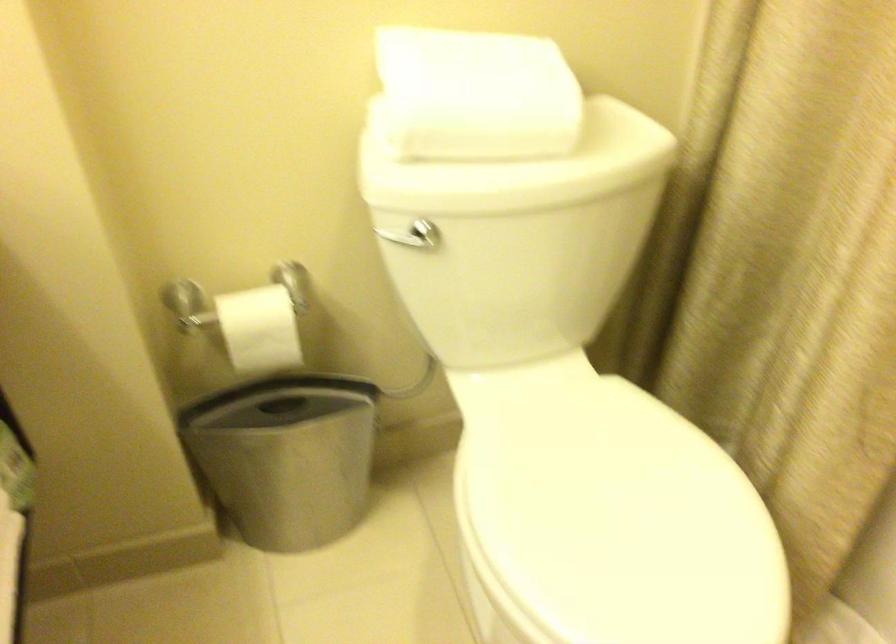
Locate an element on the screen. The height and width of the screenshot is (644, 896). toilet paper roll is located at coordinates (259, 328).